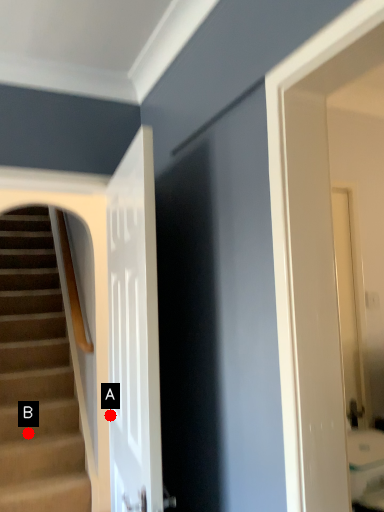
Question: Two points are circled on the image, labeled by A and B beside each circle. Which point is farther from the camera taking this photo?

Choices:
 (A) A is further
 (B) B is further

Answer: (B)